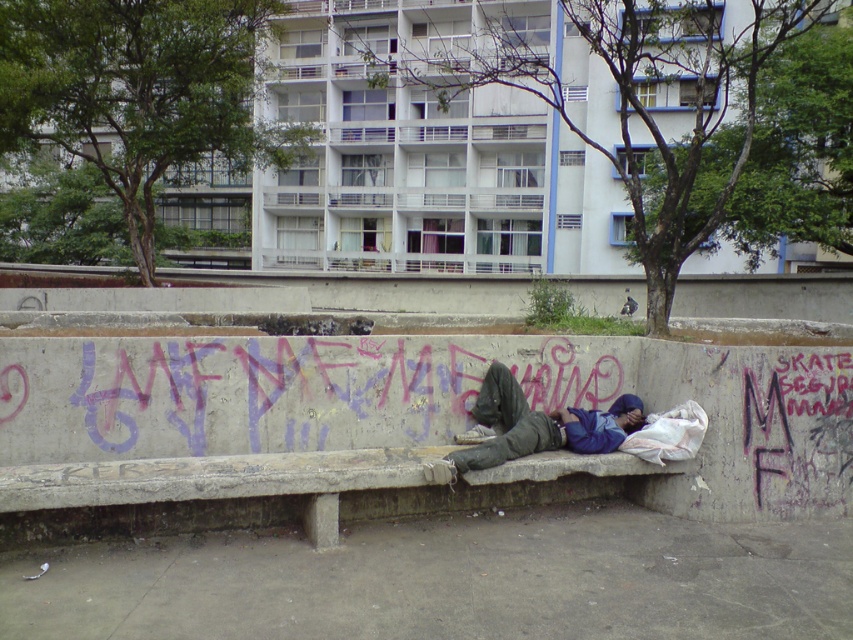
In the scene shown: Who is shorter, concrete bench at center or blue fleece jacket at center?

With less height is concrete bench at center.

The image size is (853, 640). In order to click on concrete bench at center in this screenshot , I will do `click(282, 492)`.